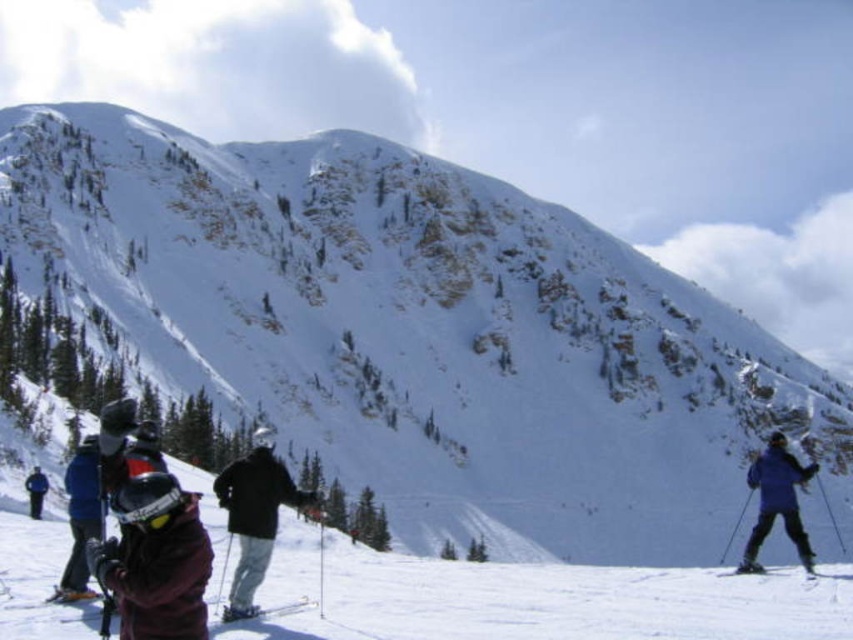
You are a photographer standing on the slope and want to capture both the purple matte jacket at lower right and the shiny black ski at lower right in a single photo. Since you can only focus on one object at a time, which object should you focus on to ensure the other is still in the frame?

The purple matte jacket at lower right is below the shiny black ski at lower right. Focus on the shiny black ski at lower right to ensure the purple matte jacket at lower right is still in the frame below it.

You are a photographer positioned at the top of the slope. You want to capture both the black matte jacket at center and the blue fabric jacket at lower left in a single shot. Which jacket will appear closer to the bottom edge of the photo?

The blue fabric jacket at lower left will appear closer to the bottom edge of the photo because it is positioned lower than the black matte jacket at center.

You are a skier standing at point (155, 560). You want to move towards the dark brown jacket at lower left. Is the dark brown jacket at lower left located to your left or right side?

The dark brown jacket at lower left is located to your left side.